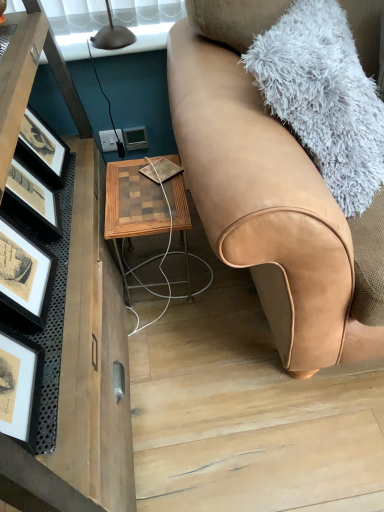
Question: From a real-world perspective, is tan leather couch at right above or below matte gray thermostat at center?

Choices:
 (A) below
 (B) above

Answer: (B)

Question: Looking at the image, does tan leather couch at right seem bigger or smaller compared to matte gray thermostat at center?

Choices:
 (A) big
 (B) small

Answer: (A)

Question: Estimate the real-world distances between objects in this image. Which object is closer to the tan leather couch at right?

Choices:
 (A) woodenmaterial/texturetable at center
 (B) matte gray thermostat at center

Answer: (A)

Question: Which object is positioned farthest from the tan leather couch at right?

Choices:
 (A) woodenmaterial/texturetable at center
 (B) matte gray thermostat at center

Answer: (B)